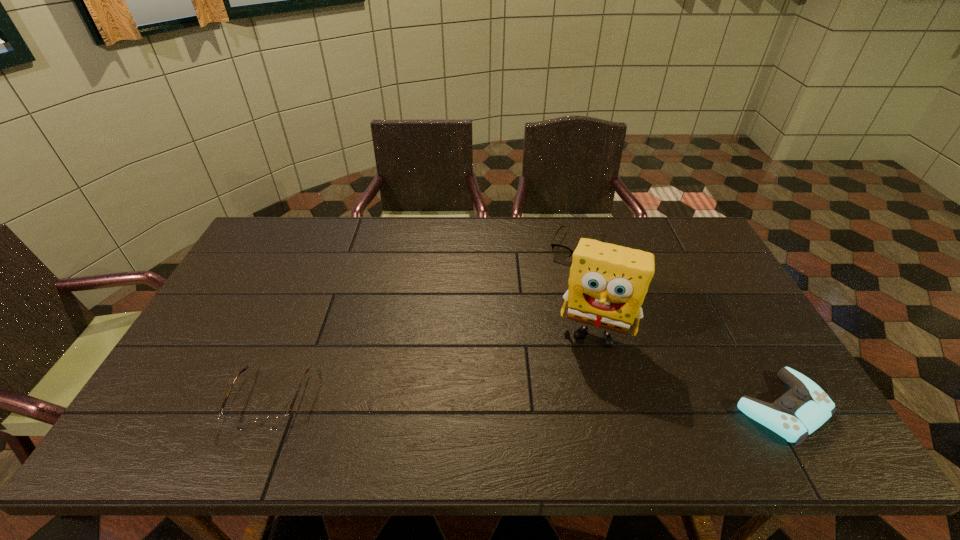
This screenshot has height=540, width=960. I want to click on free location located 0.380m on the face of the farther spectacles, so click(x=538, y=352).

I want to click on vacant space positioned 0.130m on the face of the sponge, so click(x=578, y=393).

This screenshot has height=540, width=960. I want to click on object located in the far edge section of the desktop, so click(x=561, y=252).

Where is `spectacles positioned at the near edge`? This screenshot has width=960, height=540. spectacles positioned at the near edge is located at coordinates pos(272,422).

This screenshot has width=960, height=540. Find the location of `control that is positioned at the near edge`. control that is positioned at the near edge is located at coordinates (800, 411).

Find the location of a particular element. This screenshot has width=960, height=540. object that is at the right edge is located at coordinates (800, 411).

You are a GUI agent. You are given a task and a screenshot of the screen. Output one action in this format:
    pyautogui.click(x=<x>, y=<y>)
    Task: Click on the object at the near right corner
    
    Given the screenshot: What is the action you would take?
    pyautogui.click(x=800, y=411)

This screenshot has height=540, width=960. Identify the location of vacant area at the far edge. (413, 248).

Where is `free region at the left edge of the desktop`? free region at the left edge of the desktop is located at coordinates (261, 283).

Where is `vacant space at the near left corner`? Image resolution: width=960 pixels, height=540 pixels. vacant space at the near left corner is located at coordinates (208, 406).